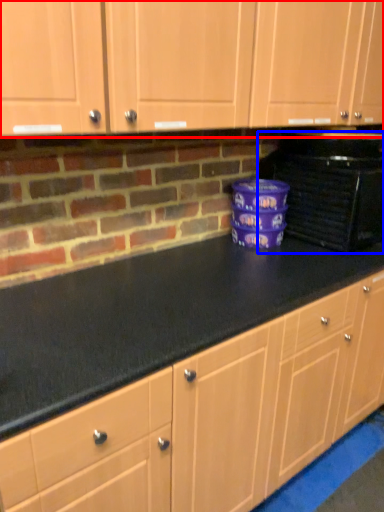
Question: Which object is further to the camera taking this photo, cabinetry (highlighted by a red box) or home appliance (highlighted by a blue box)?

Choices:
 (A) cabinetry
 (B) home appliance

Answer: (B)